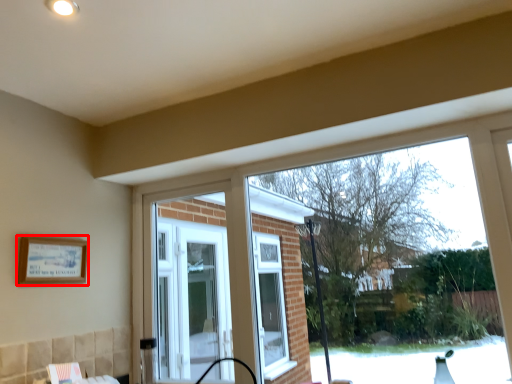
Question: Considering the relative positions of picture frame (annotated by the red box) and window in the image provided, where is picture frame (annotated by the red box) located with respect to the staircase?

Choices:
 (A) right
 (B) left

Answer: (B)